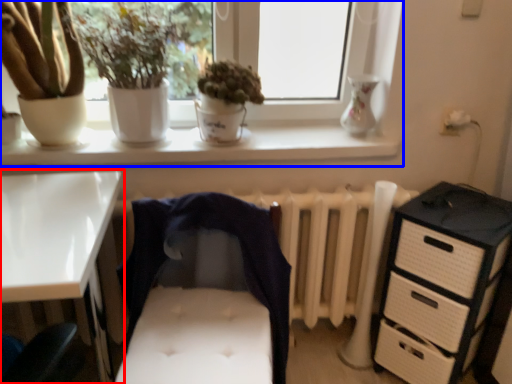
Question: Which point is closer to the camera, desk (highlighted by a red box) or window (highlighted by a blue box)?

Choices:
 (A) desk
 (B) window

Answer: (A)